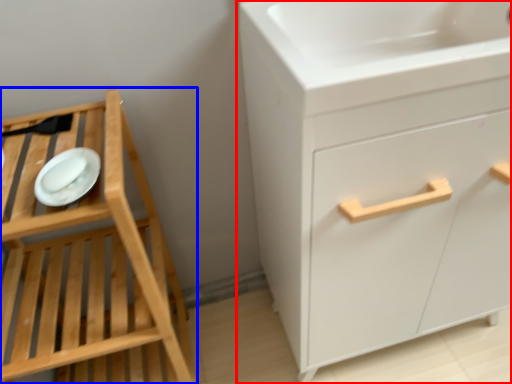
Question: Which point is further to the camera, chest of drawers (highlighted by a red box) or furniture (highlighted by a blue box)?

Choices:
 (A) chest of drawers
 (B) furniture

Answer: (A)